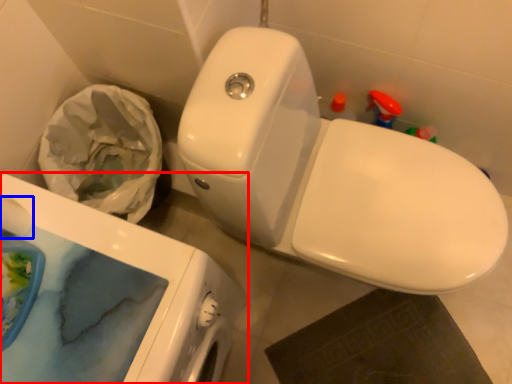
Question: Which object is closer to the camera taking this photo, porcelain (highlighted by a red box) or toilet paper (highlighted by a blue box)?

Choices:
 (A) porcelain
 (B) toilet paper

Answer: (A)